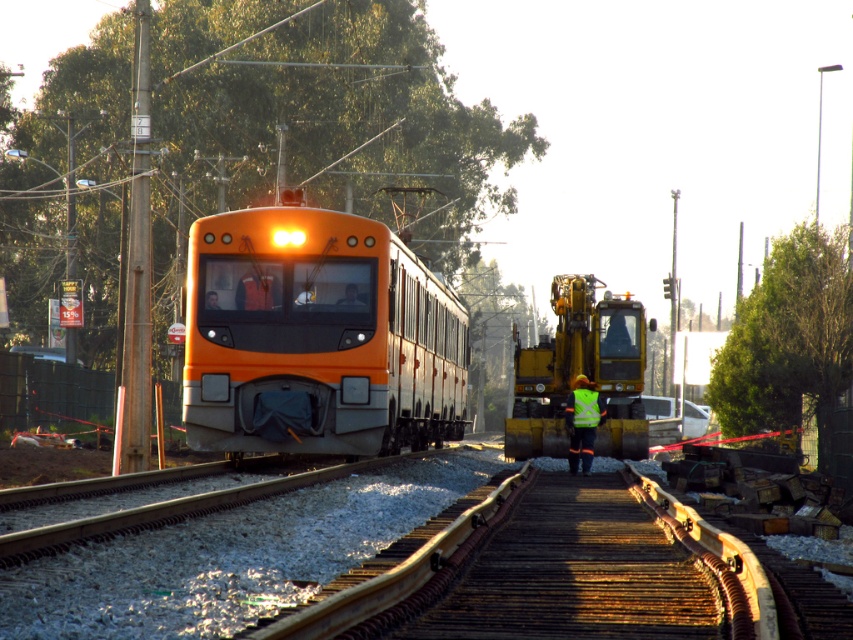
You are a safety inspector checking the railway scene. You see an orange matte train at center and a high visibility yellow vest at center. Which object is closer to the tracks?

The orange matte train at center is positioned over high visibility yellow vest at center, meaning it is closer to the tracks than the yellow vest.

You are standing at the point marked by the coordinates (x=317, y=337) in the image. What object are you directly facing?

The point at coordinates (x=317, y=337) indicates the orange matte train at center, so you are directly facing the orange matte train at center.